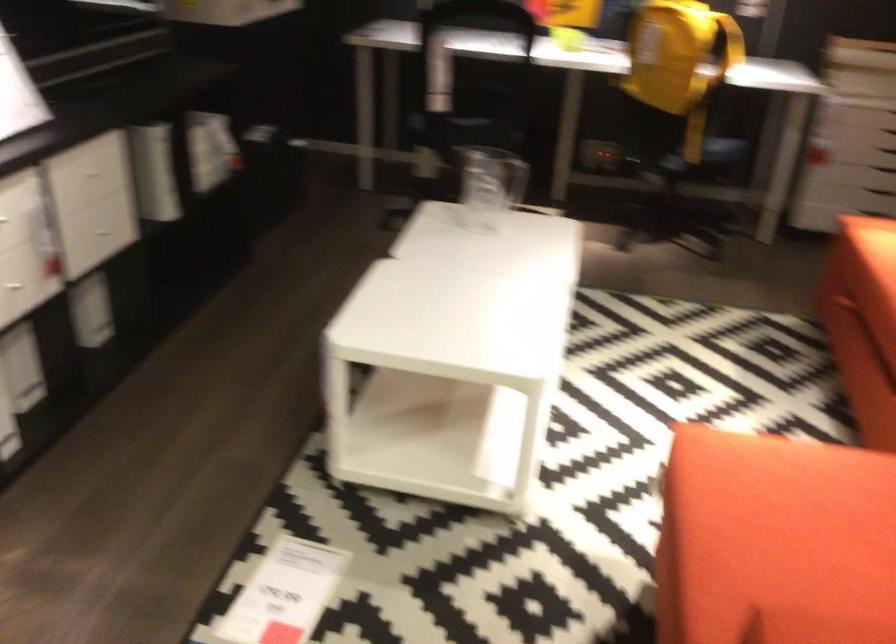
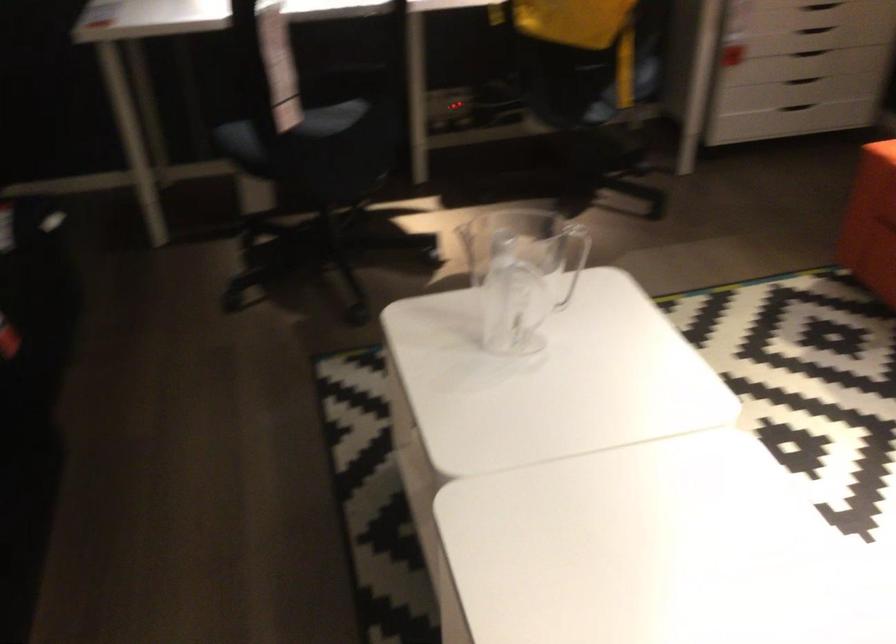
In a continuous first-person perspective shot, in which direction is the camera moving?

The cameraman walked toward left, forward.